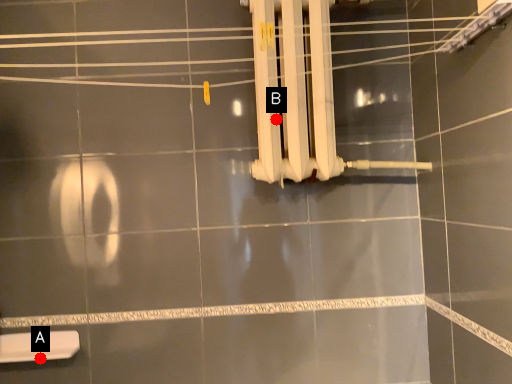
Question: Two points are circled on the image, labeled by A and B beside each circle. Which point is further to the camera?

Choices:
 (A) A is further
 (B) B is further

Answer: (A)